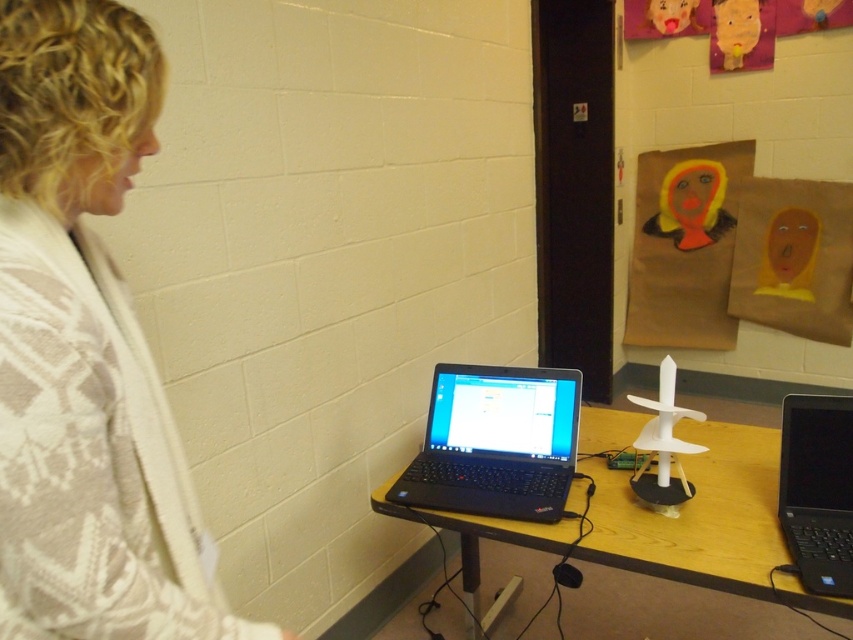
Question: Among these objects, which one is farthest from the camera?

Choices:
 (A) wooden table at center
 (B) black matte laptop at center
 (C) white textured sweater at left

Answer: (B)

Question: Which of the following is the farthest from the observer?

Choices:
 (A) (730, 524)
 (B) (788, 410)
 (C) (442, 369)
 (D) (36, 476)

Answer: (C)

Question: Which point is farther to the camera?

Choices:
 (A) black matte laptop at center
 (B) white textured sweater at left
 (C) black plastic laptop at right
 (D) wooden table at center

Answer: (A)

Question: Does white textured sweater at left appear on the left side of wooden table at center?

Choices:
 (A) no
 (B) yes

Answer: (B)

Question: Does white textured sweater at left come behind wooden table at center?

Choices:
 (A) no
 (B) yes

Answer: (A)

Question: Is black matte laptop at center positioned at the back of black plastic laptop at right?

Choices:
 (A) no
 (B) yes

Answer: (B)